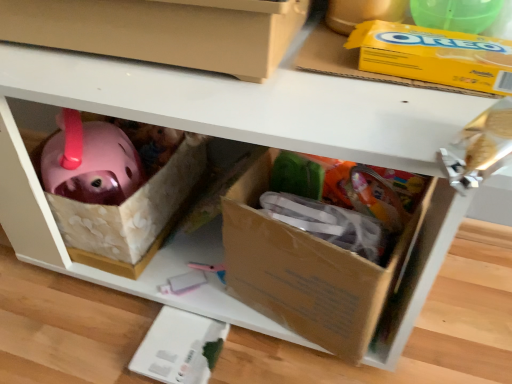
Image resolution: width=512 pixels, height=384 pixels. I want to click on vacant area to the left of yellow cardboard box at upper right, so click(310, 78).